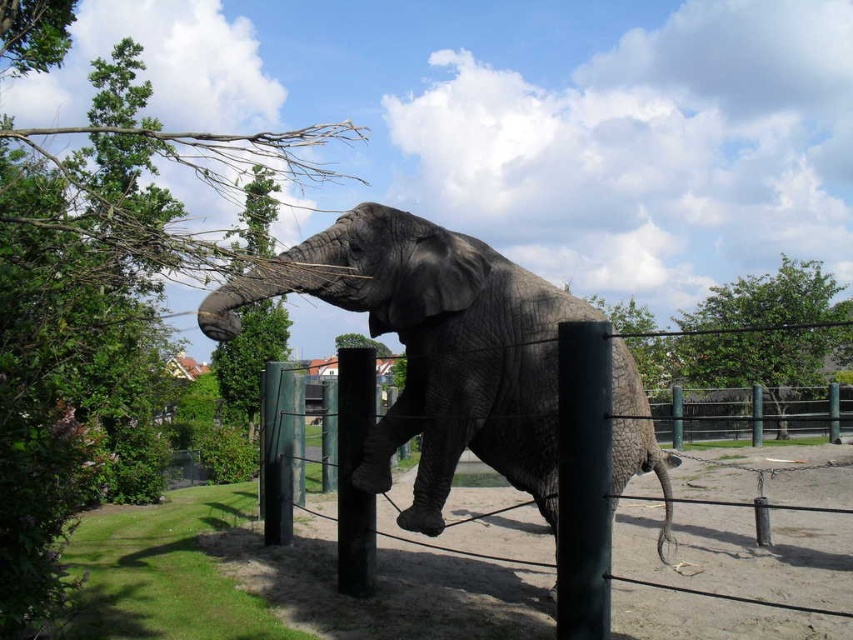
Question: Which of the following is the farthest from the observer?

Choices:
 (A) (42, 500)
 (B) (368, 524)

Answer: (B)

Question: Can you confirm if green leafy tree at upper left is smaller than green leafy tree at upper right?

Choices:
 (A) yes
 (B) no

Answer: (B)

Question: Does green painted metal pole at right appear on the right side of black metal pole at center?

Choices:
 (A) yes
 (B) no

Answer: (A)

Question: Does green leafy tree at upper left lie behind gray textured elephant at center?

Choices:
 (A) yes
 (B) no

Answer: (B)

Question: Among these objects, which one is farthest from the camera?

Choices:
 (A) green leafy tree at upper right
 (B) green painted metal fence at center

Answer: (B)

Question: Which object is positioned farthest from the green painted metal fence at center?

Choices:
 (A) green leafy tree at upper right
 (B) black metal pole at center
 (C) gray textured elephant at center
 (D) green painted metal pole at right

Answer: (A)